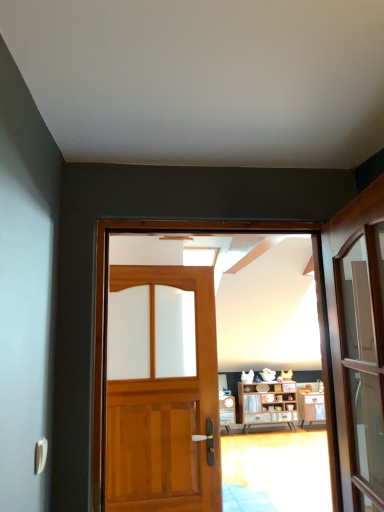
Where is `wooden door at center, which is counted as the 1th door, starting from the back`? Image resolution: width=384 pixels, height=512 pixels. wooden door at center, which is counted as the 1th door, starting from the back is located at coordinates (166, 410).

Locate an element on the screen. The image size is (384, 512). wooden cabinet at center is located at coordinates (268, 404).

The width and height of the screenshot is (384, 512). Identify the location of white glossy door handle at lower left. (40, 455).

Considering the relative sizes of wooden door at center, the first door in the front-to-back sequence, and wooden cabinet at center in the image provided, is wooden door at center, the first door in the front-to-back sequence, bigger than wooden cabinet at center?

No.

Considering the positions of objects wooden door at center, positioned as the second door in back-to-front order, and wooden cabinet at center in the image provided, who is more to the left, wooden door at center, positioned as the second door in back-to-front order, or wooden cabinet at center?

From the viewer's perspective, wooden door at center, positioned as the second door in back-to-front order, appears more on the left side.

Does wooden door at center, positioned as the second door in back-to-front order, have a greater width compared to wooden cabinet at center?

No.

Is wooden door at center, positioned as the second door in back-to-front order, far away from wooden cabinet at center?

That's not correct — wooden door at center, positioned as the second door in back-to-front order, is a little close to wooden cabinet at center.

Who is more distant, white glossy door handle at lower left or wooden door at center, which is the second door from front to back?

wooden door at center, which is the second door from front to back.

Does white glossy door handle at lower left appear on the right side of wooden door at center, which is the second door from front to back?

No, white glossy door handle at lower left is not to the right of wooden door at center, which is the second door from front to back.

From the image's perspective, who appears lower, white glossy door handle at lower left or wooden door at center, which is the second door from front to back?

wooden door at center, which is the second door from front to back, appears lower in the image.

Choose the correct answer: Is white glossy door handle at lower left inside wooden door at center, which is the second door from front to back, or outside it?

white glossy door handle at lower left is not inside wooden door at center, which is the second door from front to back, it's outside.

Is white glossy door handle at lower left positioned in front of wooden door at center, the first door in the front-to-back sequence?

Yes, white glossy door handle at lower left is closer to the viewer.

Does point (37, 461) come closer to viewer compared to point (315, 326)?

Yes, it is in front of point (315, 326).

Is white glossy door handle at lower left with wooden door at center, the first door in the front-to-back sequence?

No, white glossy door handle at lower left is not beside wooden door at center, the first door in the front-to-back sequence.

Is white glossy door handle at lower left smaller than wooden door at center, the first door in the front-to-back sequence?

Correct, white glossy door handle at lower left occupies less space than wooden door at center, the first door in the front-to-back sequence.

Can you confirm if wooden door at center, which is counted as the 1th door, starting from the back, is shorter than wooden cabinet at center?

No, wooden door at center, which is counted as the 1th door, starting from the back, is not shorter than wooden cabinet at center.

Between wooden door at center, which is counted as the 1th door, starting from the back, and wooden cabinet at center, which one has smaller size?

wooden door at center, which is counted as the 1th door, starting from the back, is smaller.

Is wooden door at center, which is the second door from front to back, looking in the opposite direction of wooden cabinet at center?

wooden door at center, which is the second door from front to back, is not turned away from wooden cabinet at center.

Considering the sizes of objects wooden door at center, which is counted as the 1th door, starting from the back, and wooden cabinet at center in the image provided, who is wider, wooden door at center, which is counted as the 1th door, starting from the back, or wooden cabinet at center?

Wider between the two is wooden door at center, which is counted as the 1th door, starting from the back.

What's the angular difference between wooden cabinet at center and wooden door at center, which is the second door from front to back,'s facing directions?

wooden cabinet at center and wooden door at center, which is the second door from front to back, are facing 96.1 degrees away from each other.

Is point (278, 384) closer or farther from the camera than point (123, 454)?

Point (278, 384).

Can you confirm if wooden cabinet at center is thinner than wooden door at center, which is counted as the 1th door, starting from the back?

Yes.

Is point (299, 275) in front of point (35, 469)?

No, it is behind (35, 469).

Is white glossy door handle at lower left completely or partially inside wooden door at center, the first door in the front-to-back sequence?

No, white glossy door handle at lower left is not surrounded by wooden door at center, the first door in the front-to-back sequence.

Considering the sizes of wooden door at center, the first door in the front-to-back sequence, and white glossy door handle at lower left in the image, is wooden door at center, the first door in the front-to-back sequence, bigger or smaller than white glossy door handle at lower left?

wooden door at center, the first door in the front-to-back sequence, is bigger than white glossy door handle at lower left.

I want to click on door above the white glossy door handle at lower left (from the image's perspective), so click(192, 349).

Considering the sizes of objects wooden cabinet at center and white glossy door handle at lower left in the image provided, who is shorter, wooden cabinet at center or white glossy door handle at lower left?

white glossy door handle at lower left.

How many degrees apart are the facing directions of wooden cabinet at center and white glossy door handle at lower left?

92.2 degrees separate the facing orientations of wooden cabinet at center and white glossy door handle at lower left.

Would you say wooden cabinet at center is a long distance from white glossy door handle at lower left?

wooden cabinet at center is far away from white glossy door handle at lower left.

From the image's perspective, is wooden cabinet at center under white glossy door handle at lower left?

Yes, from the image's perspective, wooden cabinet at center is below white glossy door handle at lower left.

I want to click on cabinetry behind the wooden door at center, positioned as the second door in back-to-front order, so click(268, 404).

Locate an element on the screen. Image resolution: width=384 pixels, height=512 pixels. door below the white glossy door handle at lower left (from the image's perspective) is located at coordinates (166, 410).

When comparing their distances from wooden cabinet at center, does wooden door at center, which is the second door from front to back, or white glossy door handle at lower left seem further?

Based on the image, white glossy door handle at lower left appears to be further to wooden cabinet at center.

Which object lies further to the anchor point wooden door at center, the first door in the front-to-back sequence, wooden door at center, which is counted as the 1th door, starting from the back, or white glossy door handle at lower left?

The object further to wooden door at center, the first door in the front-to-back sequence, is white glossy door handle at lower left.

When comparing their distances from wooden door at center, the first door in the front-to-back sequence, does white glossy door handle at lower left or wooden door at center, which is the second door from front to back, seem further?

white glossy door handle at lower left is positioned further to the anchor wooden door at center, the first door in the front-to-back sequence.

Looking at the image, which one is located closer to wooden door at center, which is the second door from front to back, white glossy door handle at lower left or wooden door at center, the first door in the front-to-back sequence?

Among the two, white glossy door handle at lower left is located nearer to wooden door at center, which is the second door from front to back.

Estimate the real-world distances between objects in this image. Which object is closer to wooden cabinet at center, wooden door at center, which is the second door from front to back, or wooden door at center, the first door in the front-to-back sequence?

wooden door at center, the first door in the front-to-back sequence.

Looking at the image, which one is located closer to white glossy door handle at lower left, wooden door at center, which is the second door from front to back, or wooden cabinet at center?

Among the two, wooden door at center, which is the second door from front to back, is located nearer to white glossy door handle at lower left.

Considering their positions, is wooden door at center, which is the second door from front to back, positioned closer to wooden door at center, the first door in the front-to-back sequence, than wooden cabinet at center?

wooden cabinet at center lies closer to wooden door at center, the first door in the front-to-back sequence, than the other object.

Looking at the image, which one is located further to wooden cabinet at center, white glossy door handle at lower left or wooden door at center, the first door in the front-to-back sequence?

Among the two, white glossy door handle at lower left is located further to wooden cabinet at center.

The height and width of the screenshot is (512, 384). Find the location of `door positioned between white glossy door handle at lower left and wooden door at center, which is the second door from front to back, from near to far`. door positioned between white glossy door handle at lower left and wooden door at center, which is the second door from front to back, from near to far is located at coordinates [x=192, y=349].

Identify the location of door located between wooden door at center, the first door in the front-to-back sequence, and wooden cabinet at center in the depth direction. Image resolution: width=384 pixels, height=512 pixels. (166, 410).